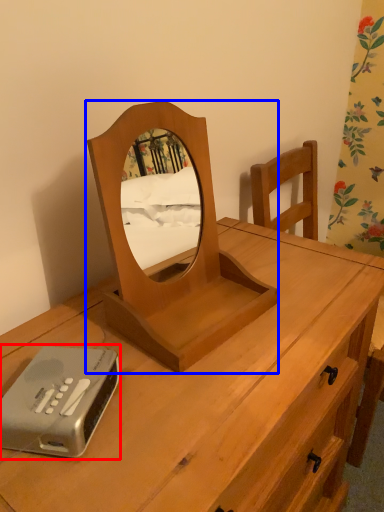
Question: Which object appears farthest to the camera in this image, gadget (highlighted by a red box) or mirror (highlighted by a blue box)?

Choices:
 (A) gadget
 (B) mirror

Answer: (A)